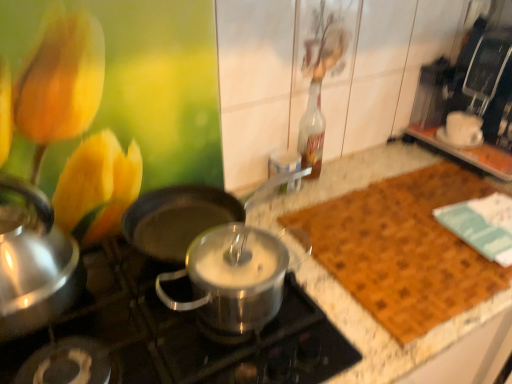
What do you see at coordinates (187, 216) in the screenshot?
I see `black matte wok at center` at bounding box center [187, 216].

Locate an element on the screen. brown woven mat at right is located at coordinates (403, 249).

Measure the distance between point (132, 313) and camera.

A distance of 30.24 inches exists between point (132, 313) and camera.

Describe the element at coordinates (34, 264) in the screenshot. I see `brushed metal kettle at left` at that location.

Identify the location of black matte wok at center. The width and height of the screenshot is (512, 384). (187, 216).

From a real-world perspective, is brushed metal kettle at left positioned over stainless steel pot at center based on gravity?

Yes, from a real-world perspective, brushed metal kettle at left is on top of stainless steel pot at center.

Which is farther from the camera, (31,310) or (129,331)?

Point (129,331)

Looking at this image, between brushed metal kettle at left and stainless steel pot at center, which one has larger width?

With larger width is stainless steel pot at center.

Consider the image. Is brushed metal kettle at left further to the viewer compared to stainless steel pot at center?

Yes, it is behind stainless steel pot at center.

The height and width of the screenshot is (384, 512). I want to click on wok that is below the translucent glass bottle at center (from the image's perspective), so click(187, 216).

Is black matte wok at center next to translucent glass bottle at center?

No, black matte wok at center is not next to translucent glass bottle at center.

Can you confirm if black matte wok at center is smaller than translucent glass bottle at center?

Incorrect, black matte wok at center is not smaller in size than translucent glass bottle at center.

Considering the relative sizes of brushed metal kettle at left and translucent glass bottle at center in the image provided, is brushed metal kettle at left thinner than translucent glass bottle at center?

No, brushed metal kettle at left is not thinner than translucent glass bottle at center.

Is brushed metal kettle at left next to translucent glass bottle at center and touching it?

There is a gap between brushed metal kettle at left and translucent glass bottle at center.

This screenshot has height=384, width=512. I want to click on kitchen appliance above the translucent glass bottle at center (from a real-world perspective), so click(x=34, y=264).

Considering the sizes of objects brushed metal kettle at left and translucent glass bottle at center in the image provided, who is shorter, brushed metal kettle at left or translucent glass bottle at center?

brushed metal kettle at left.

Can you see brushed metal kettle at left touching black matte wok at center?

No, brushed metal kettle at left is not touching black matte wok at center.

Is point (63, 247) more distant than point (297, 173)?

No, it is in front of (297, 173).

Consider the image. Considering the relative positions of brushed metal kettle at left and black matte wok at center in the image provided, is brushed metal kettle at left to the right of black matte wok at center from the viewer's perspective?

No, brushed metal kettle at left is not to the right of black matte wok at center.

Could you tell me if brushed metal kettle at left is facing black matte wok at center?

No, brushed metal kettle at left does not turn towards black matte wok at center.

Is brown woven mat at right to the left or to the right of white ceramic cup at upper right in the image?

In the image, brown woven mat at right appears on the left side of white ceramic cup at upper right.

Could you tell me if brown woven mat at right is facing white ceramic cup at upper right?

No, brown woven mat at right is not oriented towards white ceramic cup at upper right.

In the scene shown: Is brown woven mat at right positioned beyond the bounds of white ceramic cup at upper right?

Indeed, brown woven mat at right is completely outside white ceramic cup at upper right.

Is translucent glass bottle at center wider or thinner than stainless steel pot at center?

Considering their sizes, translucent glass bottle at center looks slimmer than stainless steel pot at center.

From a real-world perspective, is translucent glass bottle at center positioned over stainless steel pot at center based on gravity?

Yes.

From the image's perspective, is translucent glass bottle at center located beneath stainless steel pot at center?

No.

Can you tell me how much translucent glass bottle at center and black matte wok at center differ in facing direction?

They differ by 0.253 degrees in their facing directions.

From the image's perspective, relative to black matte wok at center, is translucent glass bottle at center above or below?

translucent glass bottle at center is situated higher than black matte wok at center in the image.

Between translucent glass bottle at center and black matte wok at center, which one has smaller width?

Thinner between the two is translucent glass bottle at center.

Consider the image. Is the surface of translucent glass bottle at center in direct contact with black matte wok at center?

No, translucent glass bottle at center is not beside black matte wok at center.

Find the location of a particular element. This screenshot has height=384, width=512. kitchen appliance above the stainless steel pot at center (from the image's perspective) is located at coordinates (34, 264).

The image size is (512, 384). I want to click on bottle lying behind the black matte wok at center, so click(x=312, y=132).

In the scene shown: From the image, which object appears to be nearer to stainless steel pot at center, black matte wok at center or white ceramic cup at upper right?

Among the two, black matte wok at center is located nearer to stainless steel pot at center.

Looking at the image, which one is located closer to white ceramic cup at upper right, stainless steel pot at center or translucent glass bottle at center?

translucent glass bottle at center.

From the image, which object appears to be nearer to black matte wok at center, stainless steel pot at center or white ceramic cup at upper right?

stainless steel pot at center is positioned closer to the anchor black matte wok at center.

Which object lies nearer to the anchor point translucent glass bottle at center, brown woven mat at right or brushed metal kettle at left?

brown woven mat at right.

Which object lies nearer to the anchor point brown woven mat at right, brushed metal kettle at left or stainless steel pot at center?

The object closer to brown woven mat at right is stainless steel pot at center.

From the image, which object appears to be farther from stainless steel pot at center, brown woven mat at right or white ceramic cup at upper right?

white ceramic cup at upper right is positioned further to the anchor stainless steel pot at center.

When comparing their distances from brown woven mat at right, does brushed metal kettle at left or black matte wok at center seem further?

The object further to brown woven mat at right is brushed metal kettle at left.

From the image, which object appears to be farther from brushed metal kettle at left, black matte wok at center or stainless steel pot at center?

black matte wok at center is further to brushed metal kettle at left.

The height and width of the screenshot is (384, 512). Identify the location of bottle between stainless steel pot at center and brown woven mat at right in the horizontal direction. (312, 132).

The width and height of the screenshot is (512, 384). What are the coordinates of `wok between brushed metal kettle at left and brown woven mat at right from left to right` in the screenshot? It's located at (187, 216).

At what (x,y) coordinates should I click in order to perform the action: click on bottle located between black matte wok at center and brown woven mat at right in the left-right direction. Please return your answer as a coordinate pair (x, y). This screenshot has width=512, height=384. Looking at the image, I should click on (312, 132).

Where is `gas stove located between brushed metal kettle at left and black matte wok at center in the left-right direction`? The image size is (512, 384). gas stove located between brushed metal kettle at left and black matte wok at center in the left-right direction is located at coordinates (176, 338).